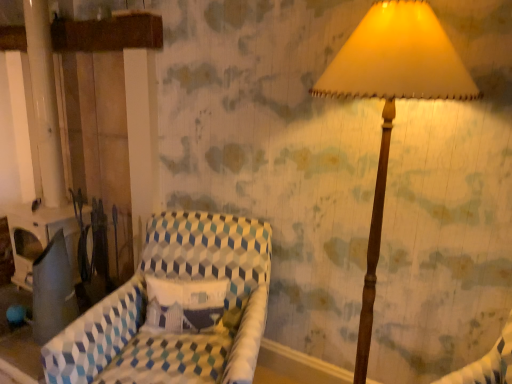
Question: From the image's perspective, is patterned fabric chair at center located above or below wooden lampshade at upper right?

Choices:
 (A) above
 (B) below

Answer: (B)

Question: Considering the positions of patterned fabric chair at center and wooden lampshade at upper right in the image, is patterned fabric chair at center taller or shorter than wooden lampshade at upper right?

Choices:
 (A) short
 (B) tall

Answer: (A)

Question: Looking at their shapes, would you say patterned fabric chair at center is wider or thinner than wooden lampshade at upper right?

Choices:
 (A) wide
 (B) thin

Answer: (A)

Question: Do you think wooden lampshade at upper right is within patterned fabric chair at center, or outside of it?

Choices:
 (A) outside
 (B) inside

Answer: (A)

Question: Considering the positions of point (368, 339) and point (70, 324), is point (368, 339) closer or farther from the camera than point (70, 324)?

Choices:
 (A) farther
 (B) closer

Answer: (B)

Question: Considering the positions of wooden lampshade at upper right and patterned fabric chair at center in the image, is wooden lampshade at upper right bigger or smaller than patterned fabric chair at center?

Choices:
 (A) small
 (B) big

Answer: (A)

Question: Considering the positions of wooden lampshade at upper right and patterned fabric chair at center in the image, is wooden lampshade at upper right taller or shorter than patterned fabric chair at center?

Choices:
 (A) short
 (B) tall

Answer: (B)